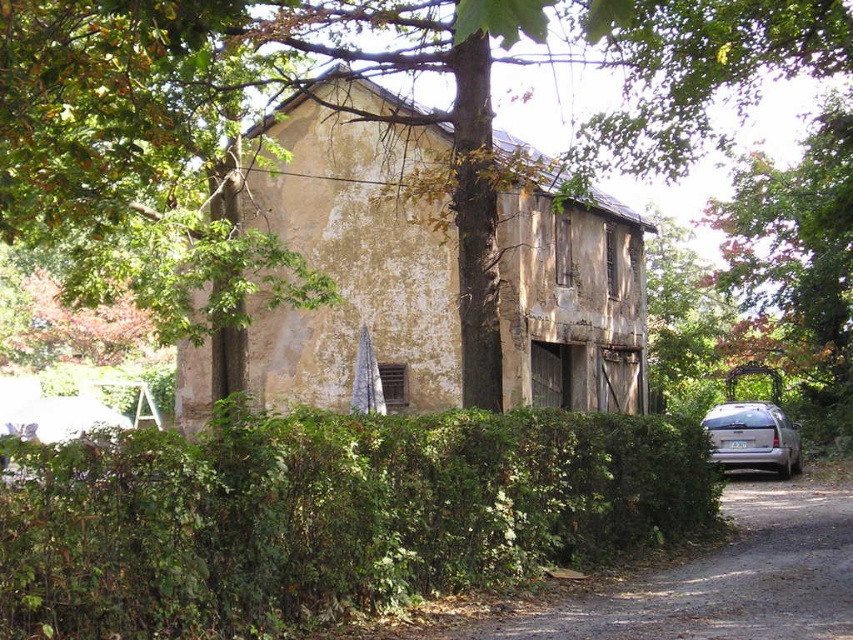
Consider the image. Does green leafy hedge at center have a larger size compared to dirt/gravel driveway at lower right?

No.

How distant is green leafy hedge at center from dirt/gravel driveway at lower right?

green leafy hedge at center and dirt/gravel driveway at lower right are 3.73 meters apart.

Who is more distant from viewer, (184, 445) or (730, 496)?

The point (730, 496) is behind.

Locate an element on the screen. green leafy hedge at center is located at coordinates (329, 515).

Is green leafy tree at upper center to the right of dirt/gravel driveway at lower right from the viewer's perspective?

Correct, you'll find green leafy tree at upper center to the right of dirt/gravel driveway at lower right.

Between green leafy tree at upper center and dirt/gravel driveway at lower right, which one has less height?

dirt/gravel driveway at lower right is shorter.

Is point (802, 26) more distant than point (718, 637)?

Yes, point (802, 26) is behind point (718, 637).

Identify the location of green leafy tree at upper center. This screenshot has height=640, width=853. (368, 109).

From the picture: Who is lower down, dirt/gravel driveway at lower right or green leafy tree at right?

dirt/gravel driveway at lower right

Which of these two, dirt/gravel driveway at lower right or green leafy tree at right, stands shorter?

dirt/gravel driveway at lower right is shorter.

Identify the location of dirt/gravel driveway at lower right. The height and width of the screenshot is (640, 853). (723, 580).